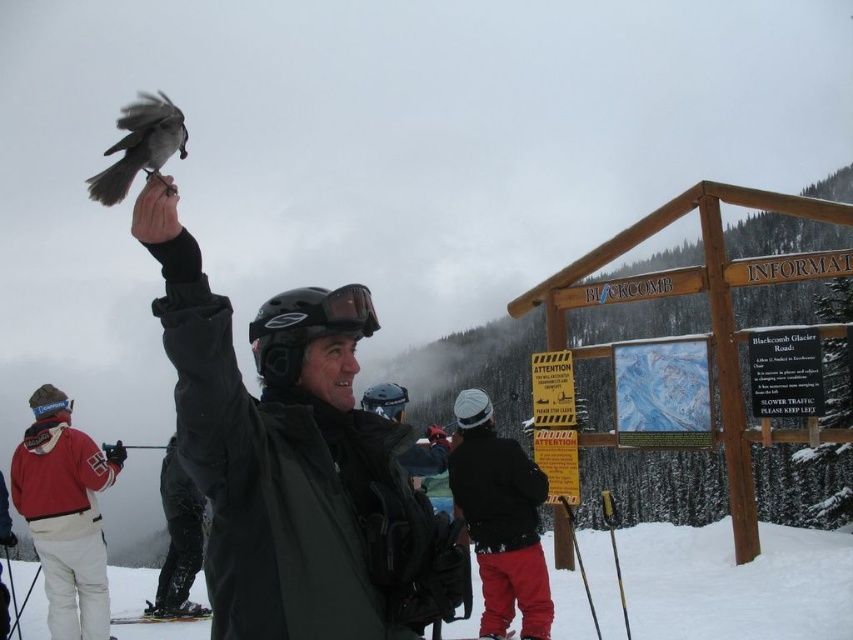
You are a photographer at the ski resort and want to capture a photo where both the black matte snow pants at lower left and the gray matte bird at upper left are clearly visible. Considering their sizes, which object might appear smaller in the photo?

The black matte snow pants at lower left has a lesser width compared to the gray matte bird at upper left, so it will appear smaller in the photo.

You are a photographer trying to capture a photo of the white snow at lower left and the black matte goggles at upper center. Which object is positioned higher in the image?

The white snow at lower left has a greater height compared to the black matte goggles at upper center, so the white snow at lower left is positioned higher in the image.

You are standing at the position of point (x=171, y=115) and want to take a photo of the Blackcomb kiosk. Is the point (x=196, y=520) between you and the kiosk?

Yes, the point (x=196, y=520) is between you and the Blackcomb kiosk because it is closer to the camera than the point (x=171, y=115), which is your current position.